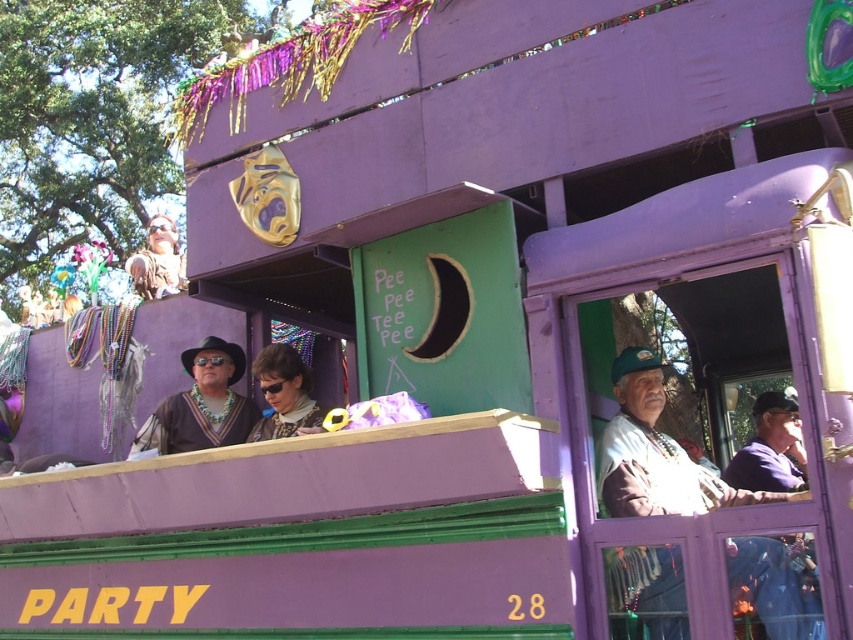
Can you confirm if white fabric coach at right is positioned to the left of matte brown hat at center?

Incorrect, white fabric coach at right is not on the left side of matte brown hat at center.

Does white fabric coach at right come behind matte brown hat at center?

No, it is in front of matte brown hat at center.

Does point (618, 586) lie in front of point (223, 356)?

Yes.

The width and height of the screenshot is (853, 640). I want to click on white fabric coach at right, so click(657, 452).

Who is taller, white fabric coach at right or matte black sunglasses at center?

white fabric coach at right

Does white fabric coach at right appear on the left side of matte black sunglasses at center?

No, white fabric coach at right is not to the left of matte black sunglasses at center.

Is point (666, 550) more distant than point (282, 422)?

No, it is in front of (282, 422).

This screenshot has width=853, height=640. I want to click on white fabric coach at right, so point(657,452).

What do you see at coordinates (201, 404) in the screenshot?
I see `matte brown hat at center` at bounding box center [201, 404].

Does matte brown hat at center have a greater height compared to matte brown leather jacket at upper left?

No.

Between point (257, 419) and point (167, 278), which one is positioned in front?

Point (257, 419)

You are a GUI agent. You are given a task and a screenshot of the screen. Output one action in this format:
    pyautogui.click(x=<x>, y=<y>)
    Task: Click on the matte brown hat at center
    
    Given the screenshot: What is the action you would take?
    pyautogui.click(x=201, y=404)